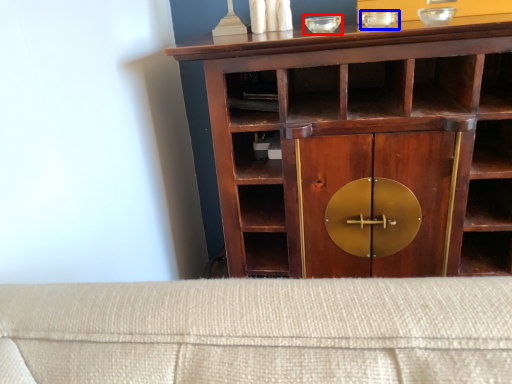
Question: Which object appears closest to the camera in this image, glass bowl (highlighted by a red box) or glass bowl (highlighted by a blue box)?

Choices:
 (A) glass bowl
 (B) glass bowl

Answer: (B)